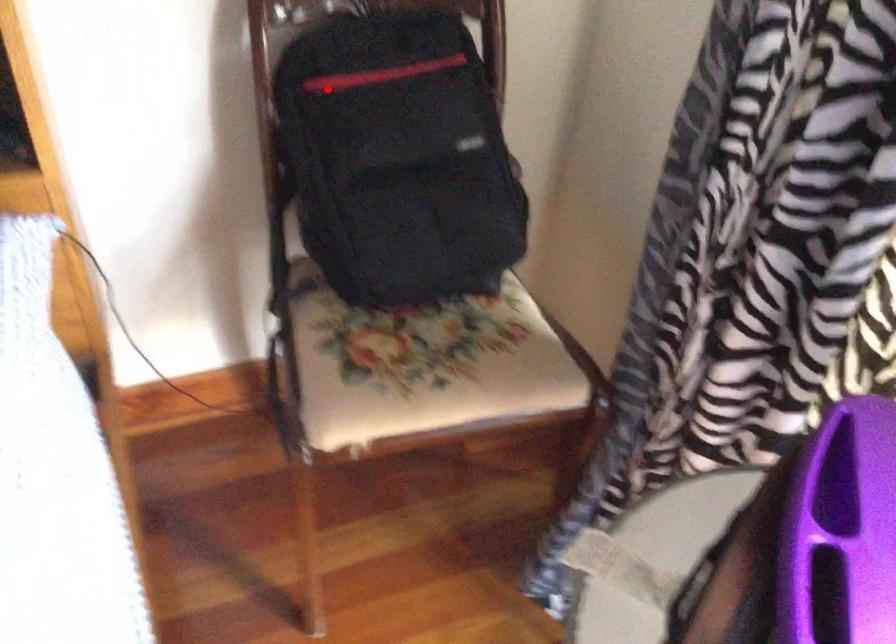
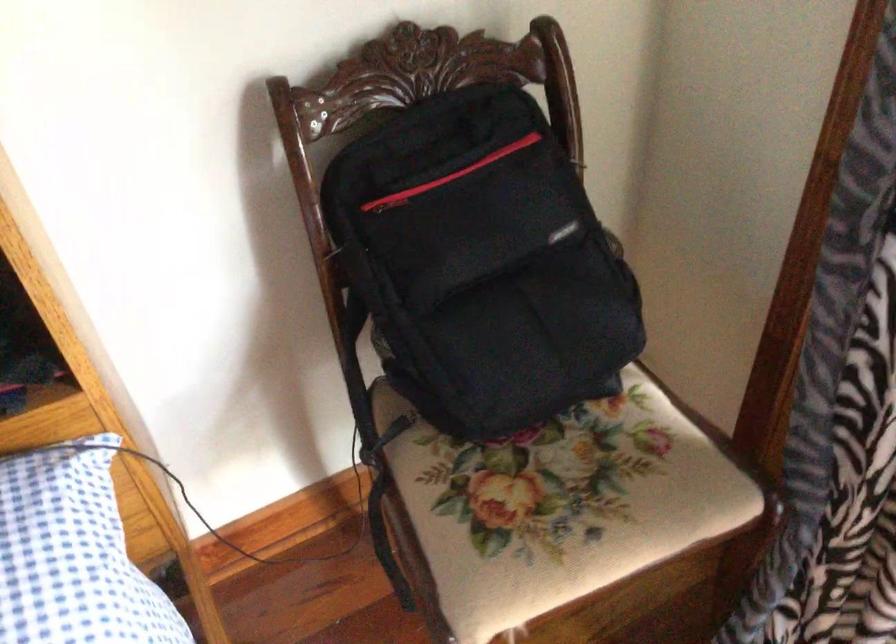
Question: I am providing you with two images of the same scene from different viewpoints. In image1, a red point is highlighted. Considering the same 3D point in image2, which of the following is correct?

Choices:
 (A) It is closer
 (B) It is farther

Answer: (A)